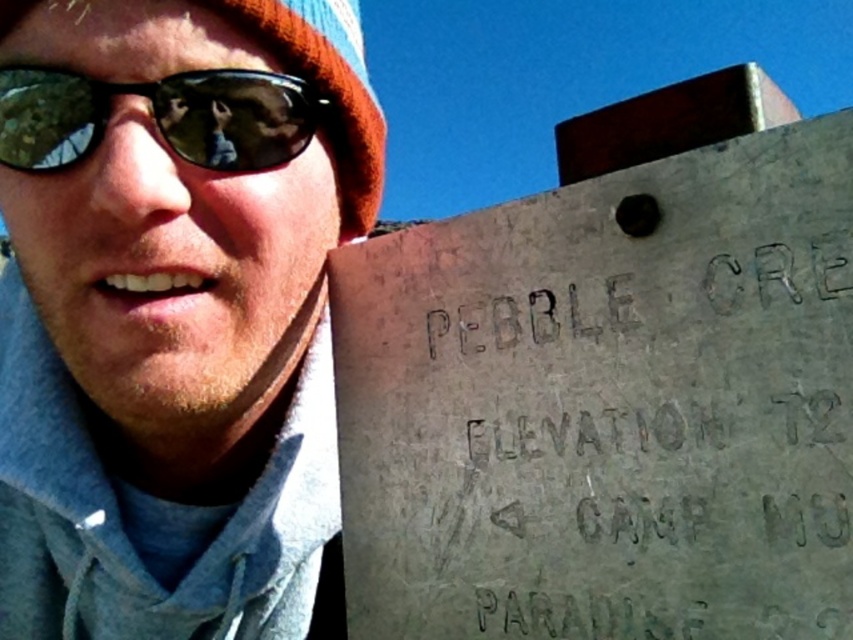
Question: Is matte gray concrete sign at upper right bigger than orange knit hat at upper left?

Choices:
 (A) yes
 (B) no

Answer: (A)

Question: Which point is closer to the camera?

Choices:
 (A) (325, 28)
 (B) (177, 109)
 (C) (265, 333)

Answer: (B)

Question: Among these objects, which one is nearest to the camera?

Choices:
 (A) green reflective lens at left
 (B) gray concrete sign at right

Answer: (B)

Question: Which of these objects is positioned farthest from the orange knit hat at upper left?

Choices:
 (A) matte gray concrete sign at upper right
 (B) green reflective lens at left
 (C) gray concrete sign at right

Answer: (C)

Question: Is gray concrete sign at right closer to the viewer compared to orange knit hat at upper left?

Choices:
 (A) no
 (B) yes

Answer: (B)

Question: Is gray concrete sign at right above green reflective lens at left?

Choices:
 (A) no
 (B) yes

Answer: (A)